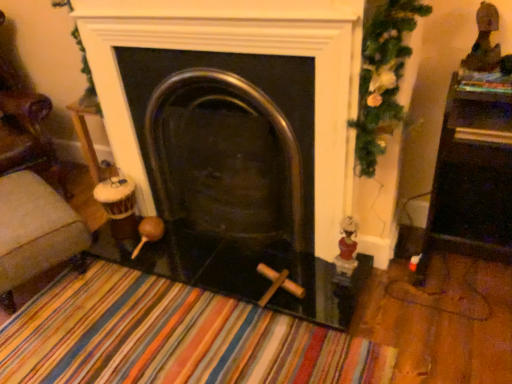
Find the location of a particular element. free spot below shiny dark brown statue at upper right, which is the 2th toy from left to right (from a real-world perspective) is located at coordinates (482, 71).